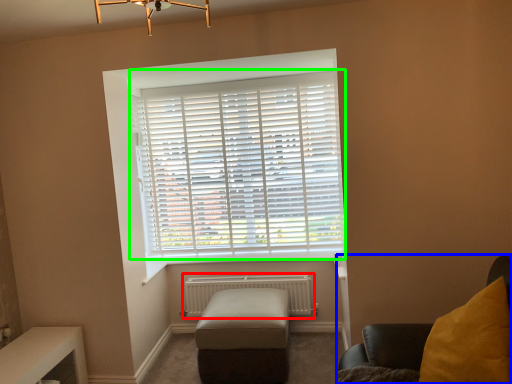
Question: Based on their relative distances, which object is farther from radiator (highlighted by a red box)? Choose from furniture (highlighted by a blue box) and window blind (highlighted by a green box).

Choices:
 (A) furniture
 (B) window blind

Answer: (A)